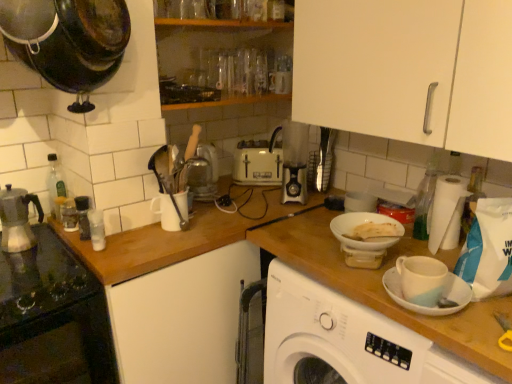
Question: From a real-world perspective, is wooden at left below white matte bottle at left, which is counted as the second bottle, starting from the right?

Choices:
 (A) yes
 (B) no

Answer: (A)

Question: Is white matte bottle at left, which is counted as the second bottle, starting from the right, at the back of wooden at left?

Choices:
 (A) no
 (B) yes

Answer: (A)

Question: Does wooden at left appear on the right side of white matte bottle at left, which is counted as the second bottle, starting from the right?

Choices:
 (A) no
 (B) yes

Answer: (B)

Question: From the image's perspective, is wooden at left below white matte bottle at left, the third bottle positioned from the left?

Choices:
 (A) no
 (B) yes

Answer: (B)

Question: Is wooden at left positioned beyond the bounds of white matte bottle at left, the third bottle positioned from the left?

Choices:
 (A) no
 (B) yes

Answer: (B)

Question: Can you confirm if wooden at left is smaller than white matte bottle at left, the third bottle positioned from the left?

Choices:
 (A) yes
 (B) no

Answer: (B)

Question: From the image's perspective, is white matte bottle at left, the third bottle positioned from the left, below translucent glass coffee machine at center?

Choices:
 (A) no
 (B) yes

Answer: (B)

Question: Is white matte bottle at left, which is counted as the second bottle, starting from the right, taller than translucent glass coffee machine at center?

Choices:
 (A) no
 (B) yes

Answer: (A)

Question: Is white matte bottle at left, which is counted as the second bottle, starting from the right, wider than translucent glass coffee machine at center?

Choices:
 (A) no
 (B) yes

Answer: (A)

Question: From a real-world perspective, is white matte bottle at left, the third bottle positioned from the left, under translucent glass coffee machine at center?

Choices:
 (A) yes
 (B) no

Answer: (A)

Question: Can you confirm if white matte bottle at left, the third bottle positioned from the left, is positioned to the left of translucent glass coffee machine at center?

Choices:
 (A) no
 (B) yes

Answer: (B)

Question: Is white matte bottle at left, which is counted as the second bottle, starting from the right, positioned before translucent glass coffee machine at center?

Choices:
 (A) no
 (B) yes

Answer: (B)

Question: Does clear plastic bottle at right, the 1th bottle from the right, have a greater height compared to wooden at left?

Choices:
 (A) yes
 (B) no

Answer: (B)